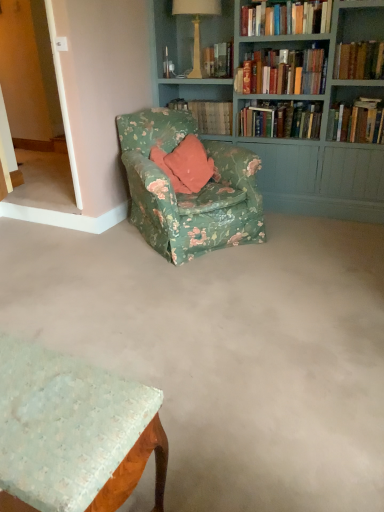
Locate an element on the screen. The width and height of the screenshot is (384, 512). free space in front of floral fabric armchair at center is located at coordinates (185, 287).